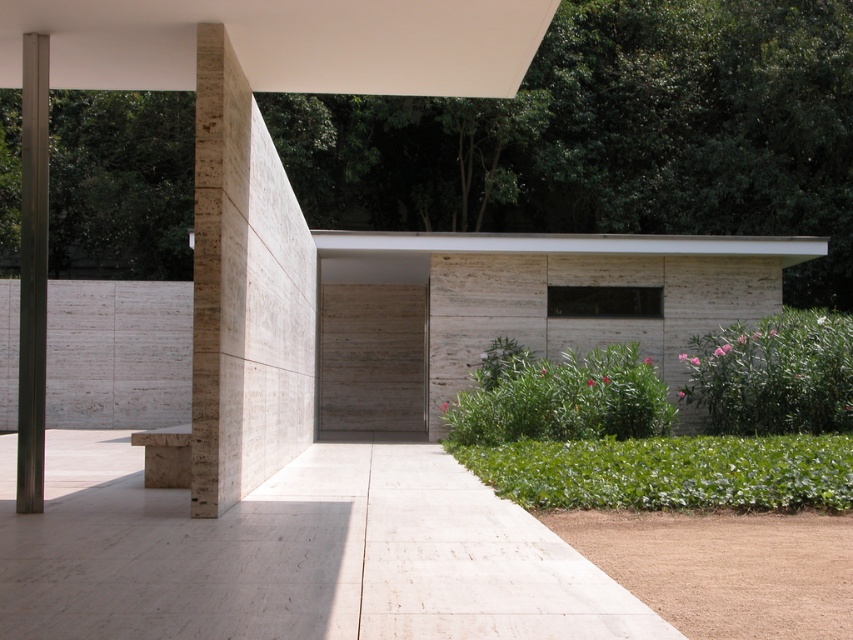
You are standing in front of the building and want to walk towards the beige stone pillar at center. Which direction should you move relative to the metallic gray pole at left?

You should move towards the center of the building, as the beige stone pillar at center is positioned over the metallic gray pole at left, meaning it is directly above it. Since you are in front of the building, moving toward the center would place you in line with both the pole and the pillar.